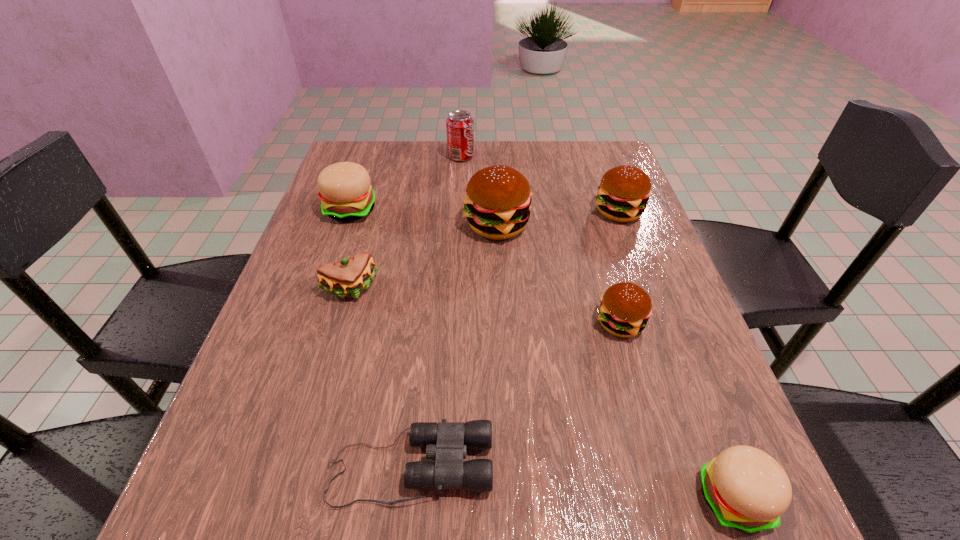
Locate an element on the screen. The image size is (960, 540). object that ranks as the second closest to the second biggest brown hamburger is located at coordinates [625, 308].

You are a GUI agent. You are given a task and a screenshot of the screen. Output one action in this format:
    pyautogui.click(x=<x>, y=<y>)
    Task: Click on the hamburger that is the second closest one to the sandwich
    This screenshot has height=540, width=960.
    Given the screenshot: What is the action you would take?
    pyautogui.click(x=497, y=202)

Point out which hamburger is positioned as the fourth nearest to the second smallest brown hamburger. Please provide its 2D coordinates. Your answer should be formatted as a tuple, i.e. [(x, y)], where the tuple contains the x and y coordinates of a point satisfying the conditions above.

[(747, 489)]

Identify which brown hamburger is located as the nearest to the second smallest brown hamburger. Please provide its 2D coordinates. Your answer should be formatted as a tuple, i.e. [(x, y)], where the tuple contains the x and y coordinates of a point satisfying the conditions above.

[(497, 202)]

The width and height of the screenshot is (960, 540). I want to click on brown hamburger that is the second nearest to the smaller beige hamburger, so click(x=497, y=202).

This screenshot has width=960, height=540. What are the coordinates of `vacant space that satisfies the following two spatial constraints: 1. on the front side of the sandwich; 2. on the left side of the leftmost hamburger` in the screenshot? It's located at (324, 288).

The width and height of the screenshot is (960, 540). Identify the location of vacant space that satisfies the following two spatial constraints: 1. on the front side of the leftmost hamburger; 2. on the right side of the fourth farthest hamburger. (312, 323).

Where is `vacant area that satisfies the following two spatial constraints: 1. at the eyepiece of the shortest object; 2. on the left side of the nearer beige hamburger`? The image size is (960, 540). vacant area that satisfies the following two spatial constraints: 1. at the eyepiece of the shortest object; 2. on the left side of the nearer beige hamburger is located at coordinates (407, 497).

Identify the location of free space that satisfies the following two spatial constraints: 1. on the front side of the farther beige hamburger; 2. on the left side of the tallest hamburger. The width and height of the screenshot is (960, 540). (346, 225).

Locate an element on the screen. This screenshot has width=960, height=540. vacant space that satisfies the following two spatial constraints: 1. on the front side of the nearest brown hamburger; 2. on the right side of the soda can is located at coordinates (451, 323).